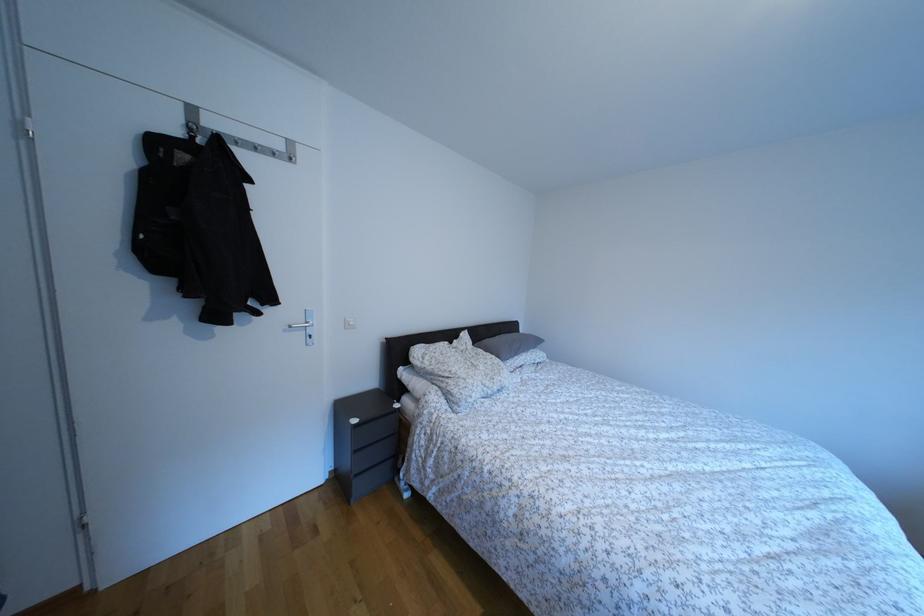
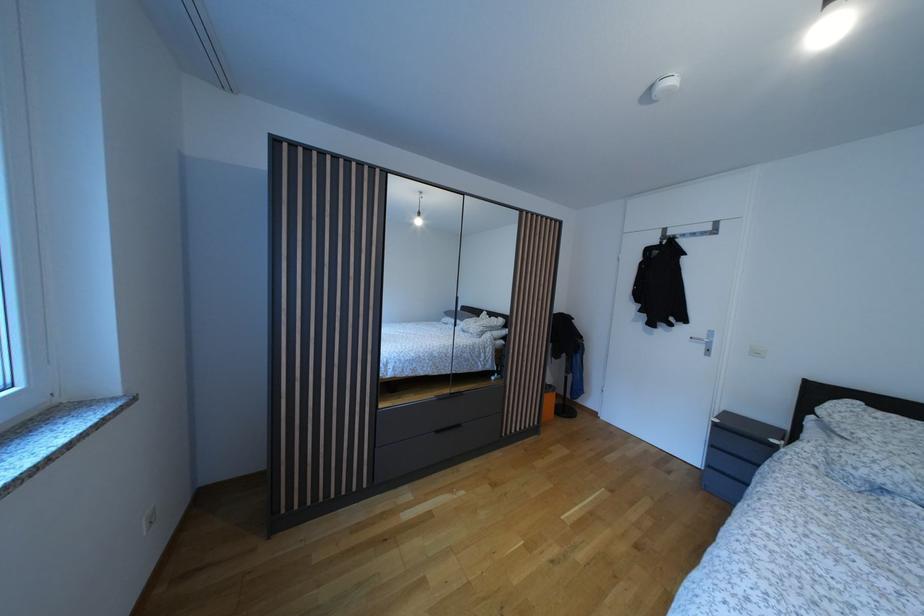
In the second image, find the point that corresponds to point 361,427 in the first image.

(723, 427)